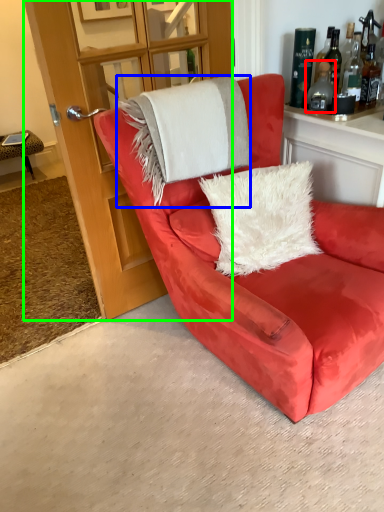
Question: Which object is the closest to the bottle (highlighted by a red box)? Choose among these: blanket (highlighted by a blue box) or glass door (highlighted by a green box).

Choices:
 (A) blanket
 (B) glass door

Answer: (A)